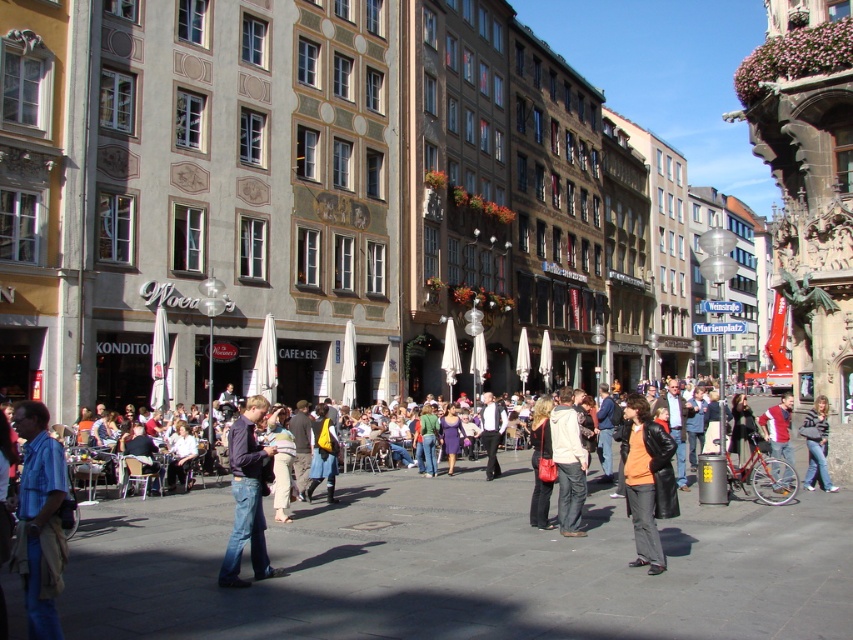
You are a photographer trying to capture both the orange matte jacket at center and the red jacket at center in a single frame. Which jacket will appear smaller in your photo?

The orange matte jacket at center will appear smaller in the photo because it is smaller than the red jacket at center.

You are standing in the urban square and want to find the denim jacket at center. Based on the coordinates given, where should you look to locate it?

The denim jacket at center is located at the 2D coordinates point [816,444].